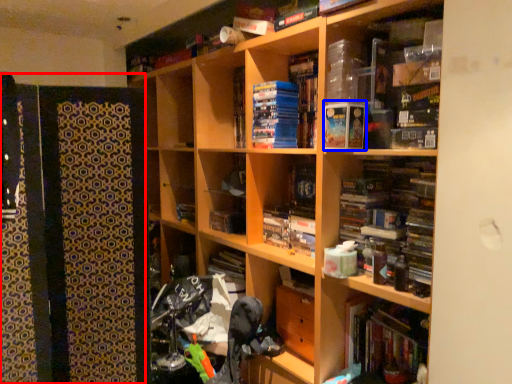
Question: Which object appears farthest to the camera in this image, cabinet (highlighted by a red box) or paperback book (highlighted by a blue box)?

Choices:
 (A) cabinet
 (B) paperback book

Answer: (B)